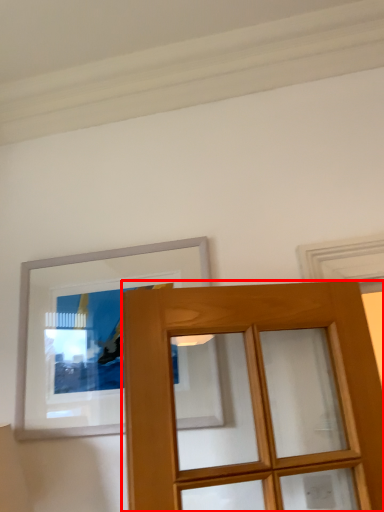
Question: From the image's perspective, what is the correct spatial positioning of door (annotated by the red box) in reference to picture frame?

Choices:
 (A) below
 (B) above

Answer: (A)